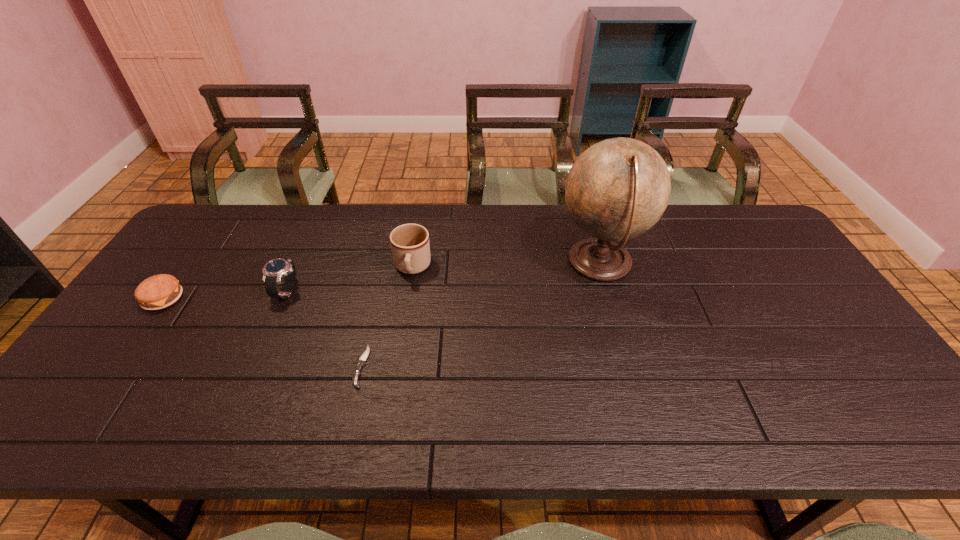
This screenshot has height=540, width=960. I want to click on vacant space situated on the front-facing side of the globe, so 424,263.

At what (x,y) coordinates should I click in order to perform the action: click on free space located 0.050m on the side of the second object from right to left with the handle. Please return your answer as a coordinate pair (x, y). The width and height of the screenshot is (960, 540). Looking at the image, I should click on (407, 299).

What are the coordinates of `free region located 0.240m on the left of the fourth object from right to left` in the screenshot? It's located at (189, 292).

You are a GUI agent. You are given a task and a screenshot of the screen. Output one action in this format:
    pyautogui.click(x=<x>, y=<y>)
    Task: Click on the free spot located on the right of the leftmost object
    Image resolution: width=960 pixels, height=540 pixels.
    Given the screenshot: What is the action you would take?
    pyautogui.click(x=315, y=299)

Find the location of a particular element. vacant space located on the back of the shortest object is located at coordinates (386, 261).

At what (x,y) coordinates should I click in order to perform the action: click on object that is at the far edge. Please return your answer as a coordinate pair (x, y). The width and height of the screenshot is (960, 540). Looking at the image, I should click on (617, 189).

At what (x,y) coordinates should I click in order to perform the action: click on object that is at the left edge. Please return your answer as a coordinate pair (x, y). This screenshot has width=960, height=540. Looking at the image, I should click on (160, 291).

Find the location of a particular element. This screenshot has height=540, width=960. free space at the far edge of the desktop is located at coordinates (433, 225).

In the image, there is a desktop. At what (x,y) coordinates should I click in order to perform the action: click on free space at the near edge. Please return your answer as a coordinate pair (x, y). Looking at the image, I should click on (260, 426).

In the image, there is a desktop. Where is `vacant space at the left edge`? vacant space at the left edge is located at coordinates (192, 269).